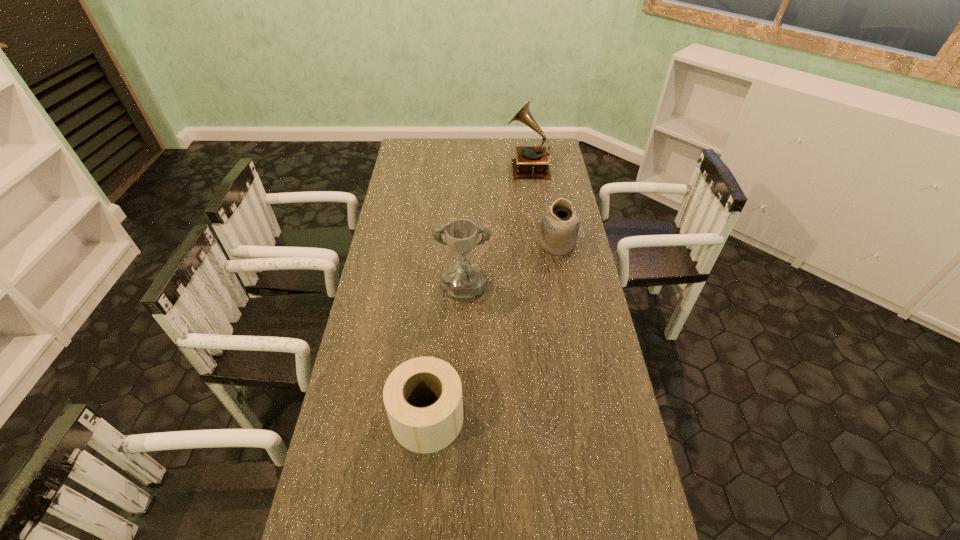
Locate an element on the screen. Image resolution: width=960 pixels, height=540 pixels. the farthest object is located at coordinates (531, 162).

Find the location of a particular element. This screenshot has height=540, width=960. the second nearest object is located at coordinates (463, 281).

You are a GUI agent. You are given a task and a screenshot of the screen. Output one action in this format:
    pyautogui.click(x=<x>, y=<y>)
    Task: Click on the third nearest object
    
    Given the screenshot: What is the action you would take?
    pyautogui.click(x=559, y=229)

Where is `the third tallest object`? the third tallest object is located at coordinates (559, 229).

Find the location of a particular element. the nearest object is located at coordinates (429, 429).

The height and width of the screenshot is (540, 960). In order to click on the shortest object in this screenshot , I will do `click(429, 429)`.

The image size is (960, 540). What are the coordinates of `vacant space positioned on the horn of the farthest object` in the screenshot? It's located at (464, 167).

Locate an element on the screen. The width and height of the screenshot is (960, 540). vacant region located on the horn of the farthest object is located at coordinates (489, 167).

Find the location of `vacant region located on the horn of the farthest object`. vacant region located on the horn of the farthest object is located at coordinates (483, 167).

I want to click on vacant space situated on the side with emblem of the third farthest object, so click(x=461, y=354).